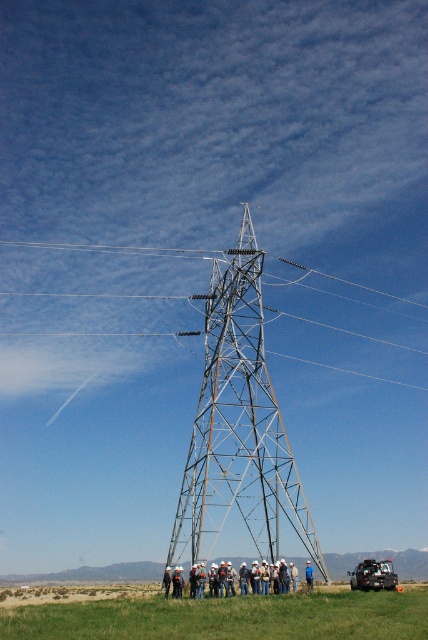
You are a drone operator tasked with capturing aerial footage of the metallic silver tower at center and the green grassy field at lower center. Based on their relative widths, which object would require a wider camera frame to fully capture in the shot?

The green grassy field at lower center requires a wider camera frame because it is wider than the metallic silver tower at center.